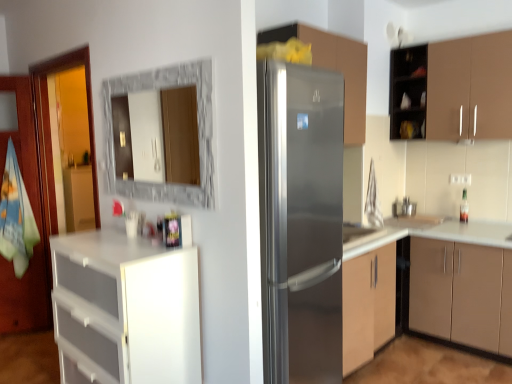
Question: Is satin silver sink at center facing towards white plastic drawers at left, arranged as the first cabinetry when viewed from the left?

Choices:
 (A) no
 (B) yes

Answer: (A)

Question: From the image's perspective, does satin silver sink at center appear lower than white plastic drawers at left, arranged as the first cabinetry when viewed from the left?

Choices:
 (A) yes
 (B) no

Answer: (B)

Question: From a real-world perspective, is satin silver sink at center located higher than white plastic drawers at left, the 4th cabinetry positioned from the right?

Choices:
 (A) no
 (B) yes

Answer: (B)

Question: Considering the relative sizes of satin silver sink at center and white plastic drawers at left, arranged as the first cabinetry when viewed from the left, in the image provided, is satin silver sink at center thinner than white plastic drawers at left, arranged as the first cabinetry when viewed from the left,?

Choices:
 (A) yes
 (B) no

Answer: (A)

Question: Does satin silver sink at center have a greater width compared to white plastic drawers at left, arranged as the first cabinetry when viewed from the left?

Choices:
 (A) no
 (B) yes

Answer: (A)

Question: From a real-world perspective, is satin silver sink at center under white plastic drawers at left, arranged as the first cabinetry when viewed from the left?

Choices:
 (A) no
 (B) yes

Answer: (A)

Question: Is marble frame mirror at upper center positioned far away from matte brown cabinet at right, acting as the 3th cabinetry starting from the left?

Choices:
 (A) yes
 (B) no

Answer: (A)

Question: Is marble frame mirror at upper center facing towards matte brown cabinet at right, marked as the 2th cabinetry in a right-to-left arrangement?

Choices:
 (A) no
 (B) yes

Answer: (A)

Question: Does marble frame mirror at upper center come behind matte brown cabinet at right, acting as the 3th cabinetry starting from the left?

Choices:
 (A) no
 (B) yes

Answer: (A)

Question: Considering the relative sizes of marble frame mirror at upper center and matte brown cabinet at right, acting as the 3th cabinetry starting from the left, in the image provided, is marble frame mirror at upper center taller than matte brown cabinet at right, acting as the 3th cabinetry starting from the left,?

Choices:
 (A) yes
 (B) no

Answer: (B)

Question: From a real-world perspective, is marble frame mirror at upper center on top of matte brown cabinet at right, marked as the 2th cabinetry in a right-to-left arrangement?

Choices:
 (A) yes
 (B) no

Answer: (A)

Question: From the image's perspective, is marble frame mirror at upper center beneath matte brown cabinet at right, marked as the 2th cabinetry in a right-to-left arrangement?

Choices:
 (A) no
 (B) yes

Answer: (A)

Question: Does satin silver refrigerator at center, which is the 2th cabinetry in left-to-right order, have a smaller size compared to stainless steel refrigerator at center?

Choices:
 (A) yes
 (B) no

Answer: (A)